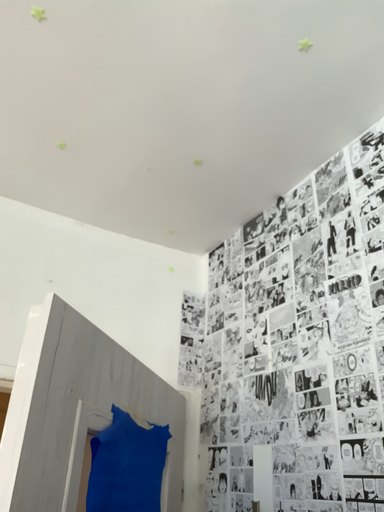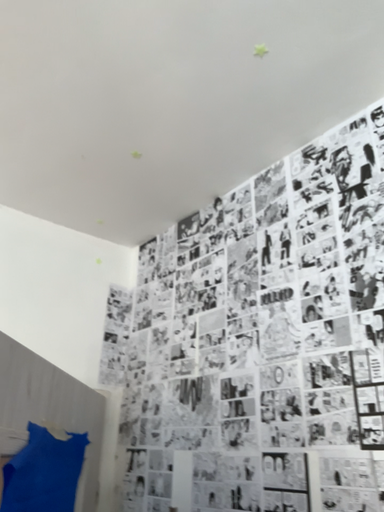
Question: Which way did the camera rotate in the video?

Choices:
 (A) rotated right
 (B) rotated left

Answer: (A)